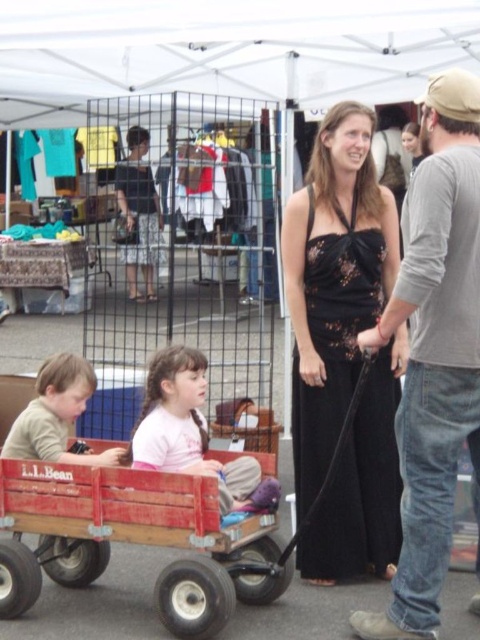
Which is more to the left, gray long-sleeved shirt at center or wooden wagon at center?

wooden wagon at center

Does gray long-sleeved shirt at center come behind wooden wagon at center?

That is False.

Who is more forward, (408, 512) or (72, 468)?

Point (408, 512)

Locate an element on the screen. gray long-sleeved shirt at center is located at coordinates pyautogui.click(x=434, y=353).

What do you see at coordinates (334, 282) in the screenshot? I see `black lace dress at center` at bounding box center [334, 282].

Between point (360, 522) and point (203, 440), which one is positioned behind?

Point (360, 522)

Find the location of a particular element. black lace dress at center is located at coordinates (334, 282).

Does gray long-sleeved shirt at center have a lesser width compared to pink fabric shirt at center?

Indeed, gray long-sleeved shirt at center has a lesser width compared to pink fabric shirt at center.

Does point (450, 404) come closer to viewer compared to point (245, 508)?

Yes, it is.

Who is more distant from viewer, (448, 230) or (263, 488)?

The point (263, 488) is behind.

The width and height of the screenshot is (480, 640). In order to click on gray long-sleeved shirt at center in this screenshot , I will do `click(434, 353)`.